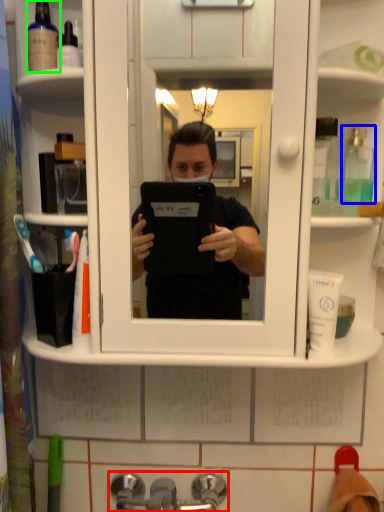
Question: Based on their relative distances, which object is nearer to tap (highlighted by a red box)? Choose from mouthwash (highlighted by a blue box) and mouthwash (highlighted by a green box).

Choices:
 (A) mouthwash
 (B) mouthwash

Answer: (A)